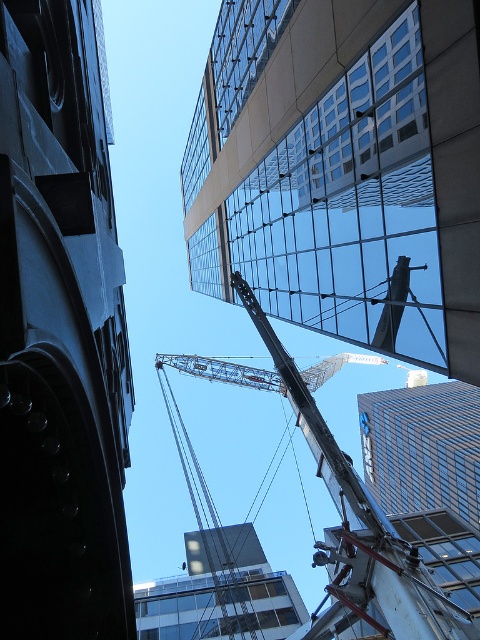
Question: Does dark gray stone tower at left have a smaller size compared to metallic gray crane at center?

Choices:
 (A) no
 (B) yes

Answer: (B)

Question: Does glassy reflective building at upper center lie behind metallic gray crane at center?

Choices:
 (A) yes
 (B) no

Answer: (B)

Question: Which object is positioned farthest from the metallic gray crane at center?

Choices:
 (A) glassy reflective building at upper center
 (B) dark gray stone tower at left

Answer: (B)

Question: Which object appears farthest from the camera in this image?

Choices:
 (A) metallic gray crane at center
 (B) glassy reflective building at upper center

Answer: (A)

Question: Where is dark gray stone tower at left located in relation to metallic gray crane at center in the image?

Choices:
 (A) right
 (B) left

Answer: (B)

Question: Among these points, which one is nearest to the camera?

Choices:
 (A) (447, 621)
 (B) (301, 188)
 (C) (76, 408)

Answer: (C)